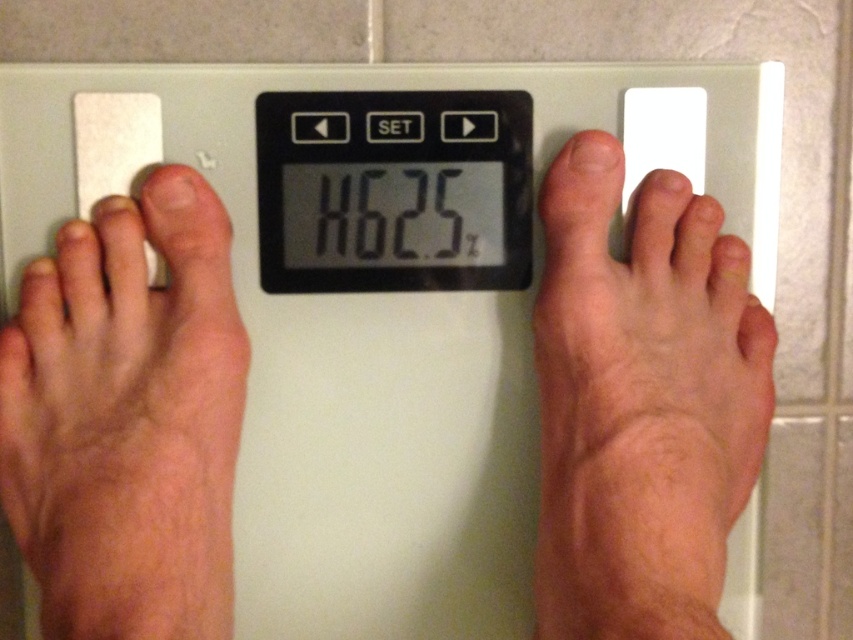
Consider the image. You are a physical therapist advising a patient on proper scale usage. The patient has a dry skin foot at left and a black plastic scale at center. Which object is positioned closer to you when standing on the scale?

The dry skin foot at left is closer to the viewer than the black plastic scale at center, so the dry skin foot at left is positioned closer.

You are a health app developer analyzing a bathroom scale image. The app needs to determine if the user is standing correctly based on the position of the objects. According to the image, is the skinny bare feet at center properly positioned under the pale skin at right?

The skinny bare feet at center is positioned under pale skin at right, so yes, the user is standing correctly with their feet properly placed under the pale skin area.